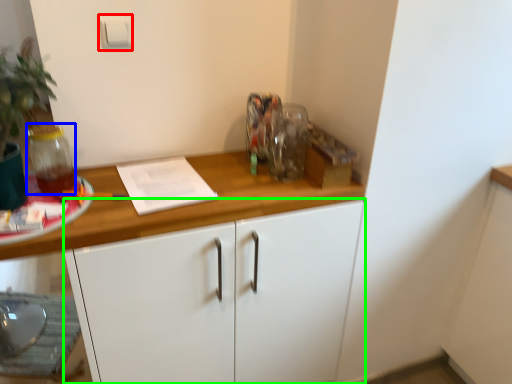
Question: Based on their relative distances, which object is nearer to light switch (highlighted by a red box)? Choose from glass jar (highlighted by a blue box) and cabinetry (highlighted by a green box).

Choices:
 (A) glass jar
 (B) cabinetry

Answer: (A)